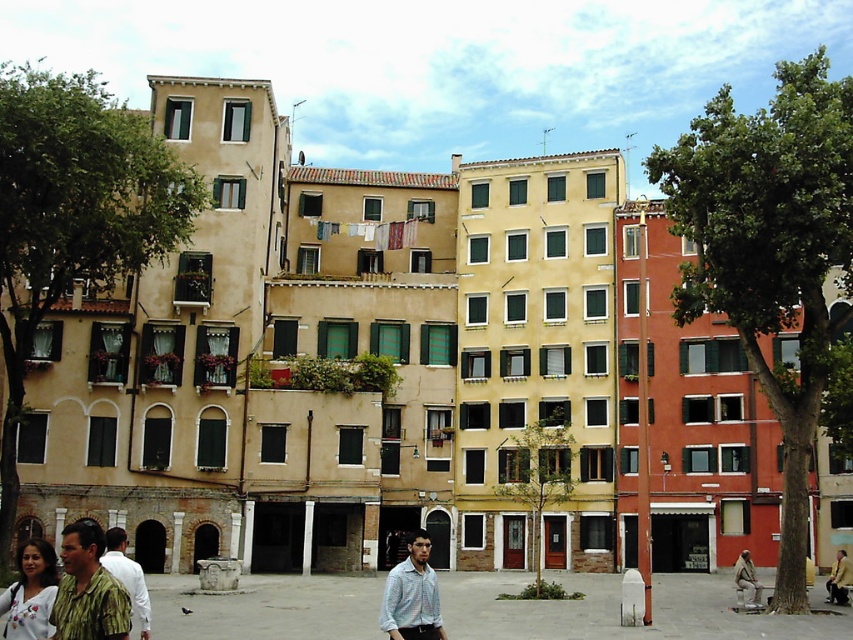
Does point (751, 577) lie in front of point (833, 564)?

Yes, point (751, 577) is closer to viewer.

Describe the element at coordinates (747, 580) in the screenshot. I see `light brown fabric at lower right` at that location.

You are a GUI agent. You are given a task and a screenshot of the screen. Output one action in this format:
    pyautogui.click(x=<x>, y=<y>)
    Task: Click on the light brown fabric at lower right
    This screenshot has width=853, height=640.
    Given the screenshot: What is the action you would take?
    pyautogui.click(x=747, y=580)

Is green floral shirt at lower left smaller than camouflage shirt at lower left?

Actually, green floral shirt at lower left might be larger than camouflage shirt at lower left.

Is green floral shirt at lower left positioned at the back of camouflage shirt at lower left?

That is False.

Identify the location of green floral shirt at lower left. (88, 589).

This screenshot has height=640, width=853. I want to click on green floral shirt at lower left, so click(88, 589).

Is white embroidered blouse at lower left thinner than yellow leather jacket at lower right?

No, white embroidered blouse at lower left is not thinner than yellow leather jacket at lower right.

Does point (32, 636) come in front of point (843, 595)?

Yes, point (32, 636) is closer to viewer.

The image size is (853, 640). What are the coordinates of `white embroidered blouse at lower left` in the screenshot? It's located at click(30, 593).